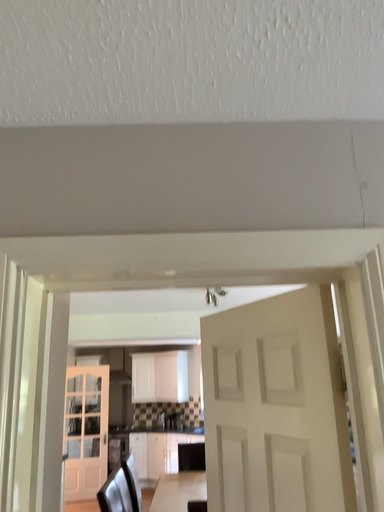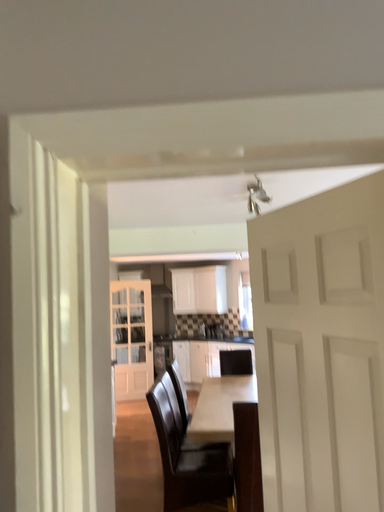
Question: How did the camera likely rotate when shooting the video?

Choices:
 (A) rotated upward
 (B) rotated downward

Answer: (B)